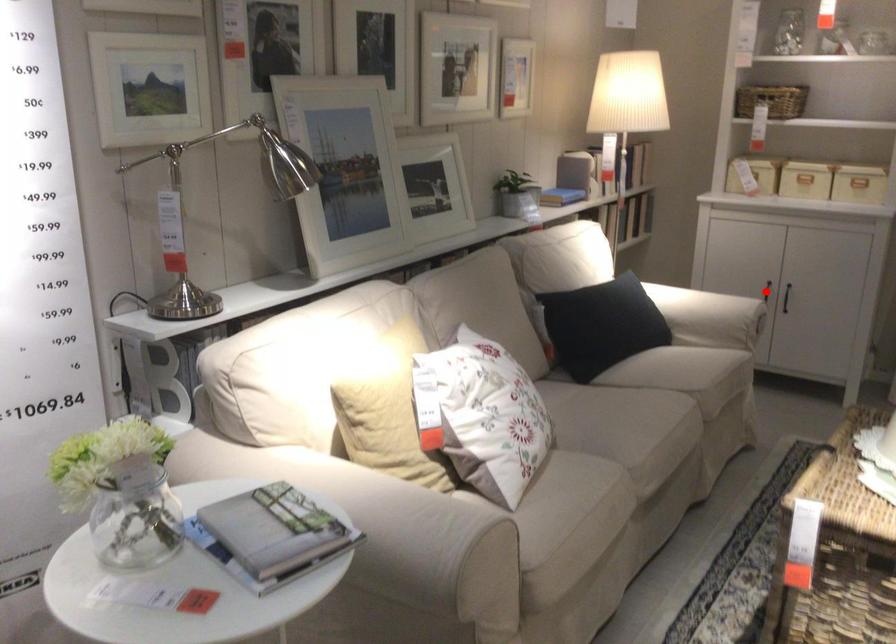
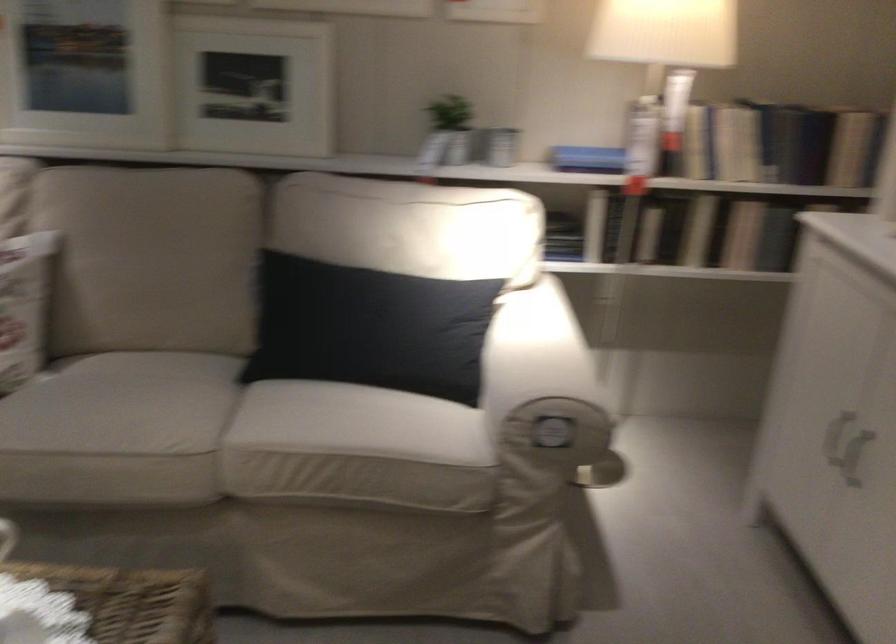
Question: I am providing you with two images of the same scene from different viewpoints. A red point is marked on the first image. Is the red point's position out of view in image 2?

Choices:
 (A) Yes
 (B) No

Answer: (A)